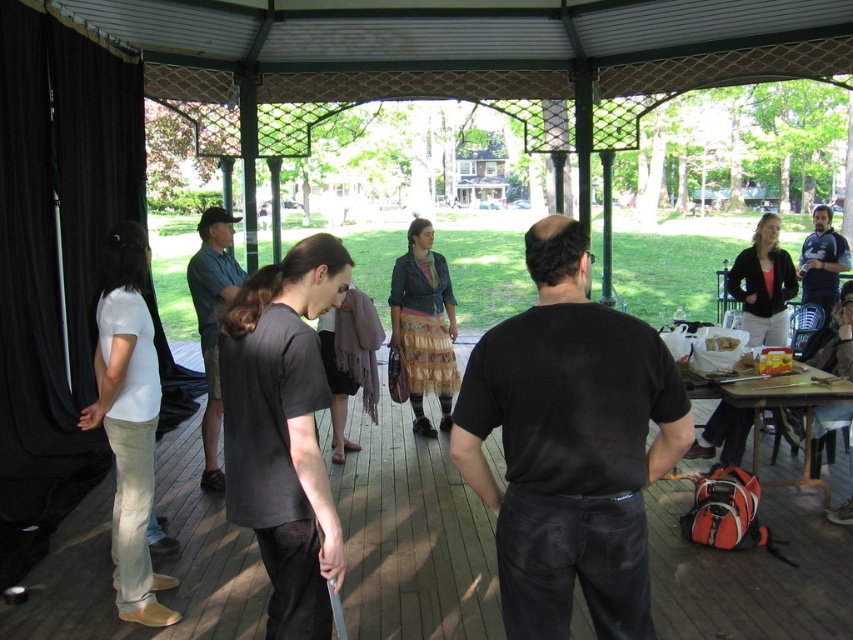
You are standing at the entrance of the gazebo and want to hand a document to the person wearing the black matte shirt at center. According to the spatial layout, where should you walk to find them?

The black matte shirt at center is located at point (570,445), so you should walk towards the coordinates (570,445) to reach them.

You are organizing a group photo and need to arrange the black matte shirt at center and the blue denim shirt at right side by side. Based on their sizes, which one should be placed on the left to ensure they fit within a 1.5 meter wide frame?

The black matte shirt at center has a smaller width than the blue denim shirt at right, so placing the black matte shirt at center on the left and the blue denim shirt at right next to it would allow both to fit within the 1.5 meter wide frame since their combined widths are likely under 1.5 meters.

You are planning to place a 1.5 meter long picnic basket on the wooden picnic table at lower right. Can the blue denim shirt at right sit at the end of the table to help you unpack?

The wooden picnic table at lower right might be wider than blue denim shirt at right, so there is a possibility that the blue denim shirt at right can sit at the end of the table to help unpack the picnic basket.